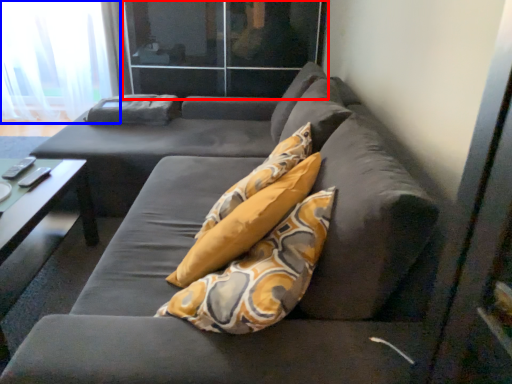
Question: Which of the following is the farthest to the observer, glass door (highlighted by a red box) or curtain (highlighted by a blue box)?

Choices:
 (A) glass door
 (B) curtain

Answer: (B)